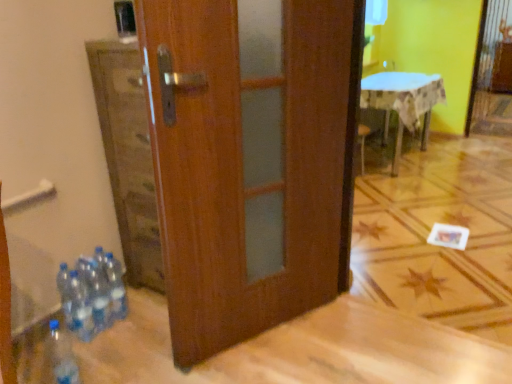
Question: Relative to clear plastic bottles at lower left, positioned as the 3th bottle in front-to-back order, is clear plastic bottle at lower left, which ranks as the 4th bottle in back-to-front order, in front or behind?

Choices:
 (A) front
 (B) behind

Answer: (A)

Question: Is clear plastic bottle at lower left, which ranks as the 4th bottle in back-to-front order, to the left or to the right of clear plastic bottles at lower left, positioned as the 3th bottle in front-to-back order, in the image?

Choices:
 (A) right
 (B) left

Answer: (A)

Question: Which is nearer to the clear plastic bottles at lower left, which appears as the second bottle when viewed from the back?

Choices:
 (A) clear plastic bottles at lower left, which is the 4th bottle from front to back
 (B) clear plastic bottle at lower left, which ranks as the 4th bottle in back-to-front order
 (C) clear plastic bottles at lower left, the 3th bottle positioned from the back
 (D) white cloth-covered table at upper right

Answer: (A)

Question: Which is farther from the white cloth-covered table at upper right?

Choices:
 (A) clear plastic bottles at lower left, which appears as the second bottle when viewed from the front
 (B) clear plastic bottles at lower left, acting as the 1th bottle starting from the back
 (C) clear plastic bottles at lower left, positioned as the 3th bottle in front-to-back order
 (D) clear plastic bottle at lower left, which ranks as the 4th bottle in back-to-front order

Answer: (D)